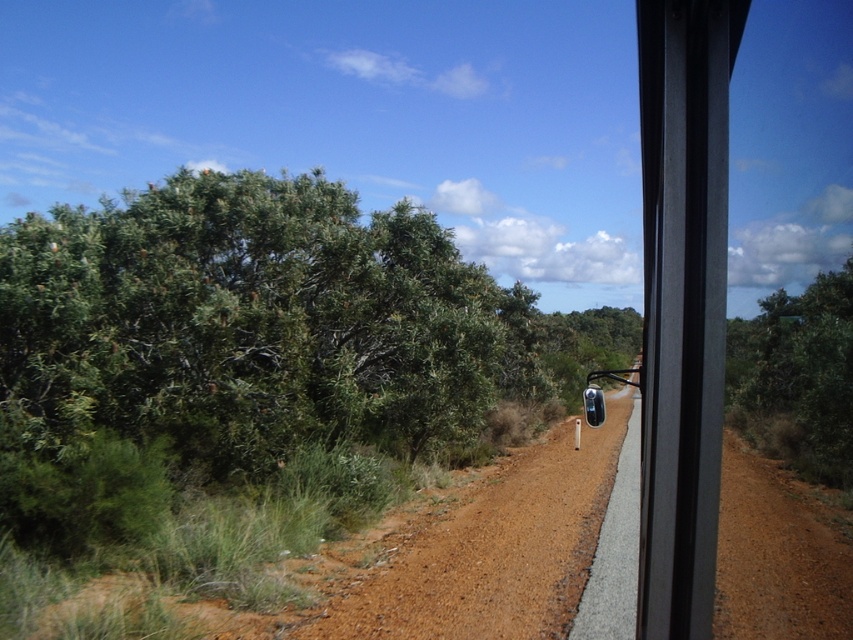
Question: Is the position of brown gravelly dirt track at center more distant than that of transparent plastic mirror at center?

Choices:
 (A) yes
 (B) no

Answer: (B)

Question: Can you confirm if brown gravelly dirt track at center is thinner than transparent plastic mirror at center?

Choices:
 (A) no
 (B) yes

Answer: (B)

Question: Which point is farther to the camera?

Choices:
 (A) transparent plastic mirror at center
 (B) green leafy bush at left

Answer: (B)

Question: Can you confirm if green leafy bush at left is positioned below brown gravelly dirt track at center?

Choices:
 (A) no
 (B) yes

Answer: (A)

Question: Which point is closer to the camera?

Choices:
 (A) (738, 372)
 (B) (173, 348)
 (C) (434, 625)
 (D) (604, 584)

Answer: (C)

Question: Among these points, which one is nearest to the camera?

Choices:
 (A) (614, 554)
 (B) (271, 184)
 (C) (836, 336)

Answer: (A)